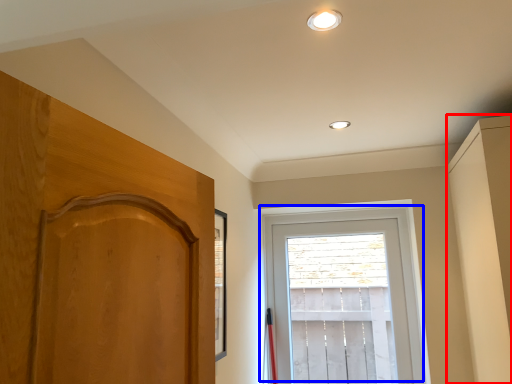
Question: Which object appears farthest to the camera in this image, dresser (highlighted by a red box) or window (highlighted by a blue box)?

Choices:
 (A) dresser
 (B) window

Answer: (B)